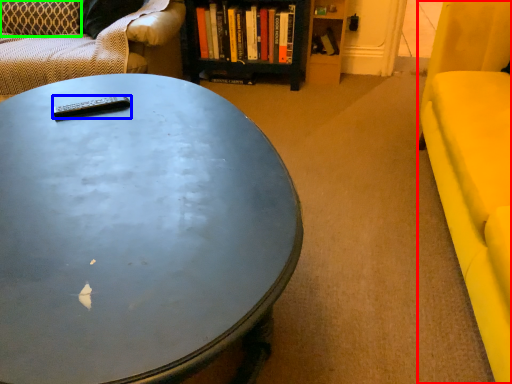
Question: Which object is positioned farthest from armchair (highlighted by a red box)? Select from remote control (highlighted by a blue box) and pillow (highlighted by a green box).

Choices:
 (A) remote control
 (B) pillow

Answer: (B)